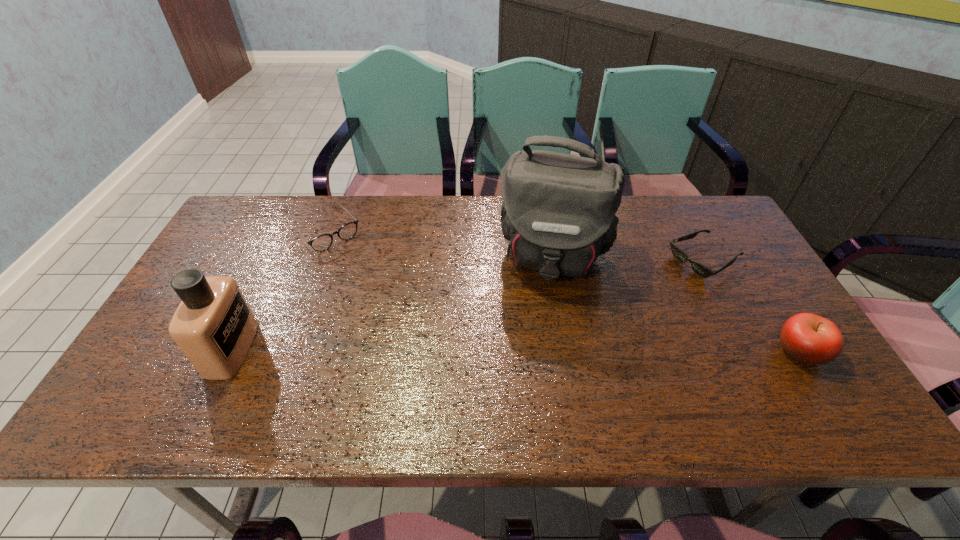
Where is `free region at the left edge`? This screenshot has width=960, height=540. free region at the left edge is located at coordinates (206, 272).

The height and width of the screenshot is (540, 960). Identify the location of vacant area at the far left corner. (221, 237).

Identify the location of vacant area that lies between the perfume and the shortest object. (468, 305).

I want to click on blank region between the third tallest object and the spectacles, so pos(563,291).

You are a GUI agent. You are given a task and a screenshot of the screen. Output one action in this format:
    pyautogui.click(x=<x>, y=<y>)
    Task: Click on the free space between the second tallest object and the shortest object
    The image size is (960, 540).
    Given the screenshot: What is the action you would take?
    pyautogui.click(x=468, y=305)

Locate an element on the screen. This screenshot has width=960, height=540. vacant space in between the perfume and the third shortest object is located at coordinates (516, 350).

At what (x,y) coordinates should I click in order to perform the action: click on vacant area that lies between the apple and the shoulder bag. Please return your answer as a coordinate pair (x, y). The image size is (960, 540). Looking at the image, I should click on (678, 304).

Locate an element on the screen. Image resolution: width=960 pixels, height=540 pixels. vacant point located between the spectacles and the tallest object is located at coordinates (440, 244).

In order to click on vacant space in between the second tallest object and the spectacles in this screenshot , I will do `click(278, 290)`.

Where is `vacant area that lies between the sunglasses and the third shortest object`? This screenshot has width=960, height=540. vacant area that lies between the sunglasses and the third shortest object is located at coordinates (752, 306).